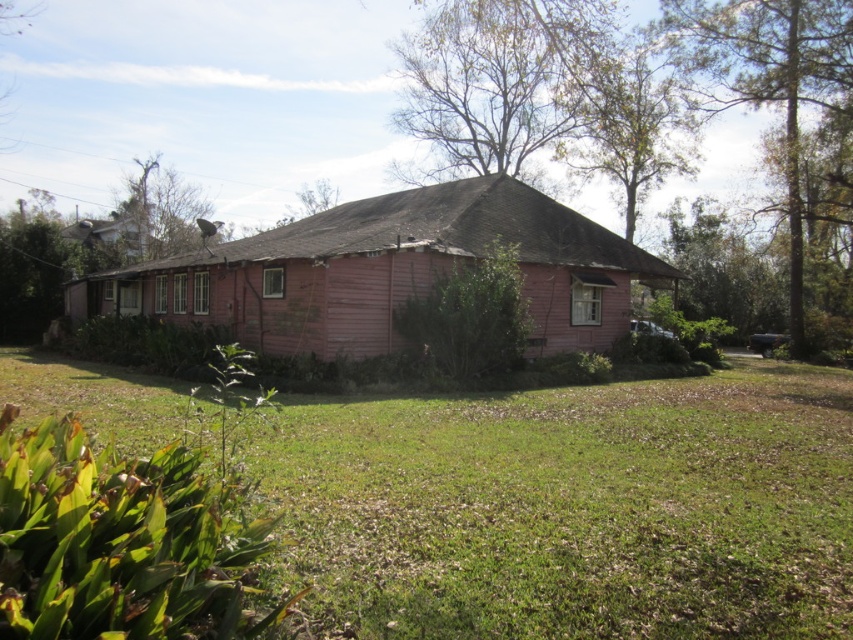
In the scene shown: Can you confirm if pink wood house at center is positioned to the right of green leafy tree at upper right?

Incorrect, pink wood house at center is not on the right side of green leafy tree at upper right.

Measure the distance between pink wood house at center and green leafy tree at upper right.

pink wood house at center is 16.00 meters from green leafy tree at upper right.

The width and height of the screenshot is (853, 640). Identify the location of pink wood house at center. (387, 273).

From the picture: Does green grass at lower center appear under pink wood house at center?

Yes.

Does green grass at lower center come in front of pink wood house at center?

Yes, green grass at lower center is closer to the viewer.

At what (x,y) coordinates should I click in order to perform the action: click on green grass at lower center. Please return your answer as a coordinate pair (x, y). Looking at the image, I should click on (573, 508).

Where is `green grass at lower center`? The width and height of the screenshot is (853, 640). green grass at lower center is located at coordinates (573, 508).

Does green leafy bush at center have a lesser width compared to metallic satellite dish at upper left?

Yes, green leafy bush at center is thinner than metallic satellite dish at upper left.

Does point (467, 348) come closer to viewer compared to point (148, 221)?

Yes, point (467, 348) is in front of point (148, 221).

You are a GUI agent. You are given a task and a screenshot of the screen. Output one action in this format:
    pyautogui.click(x=<x>, y=<y>)
    Task: Click on the green leafy bush at center
    Image resolution: width=853 pixels, height=640 pixels.
    Given the screenshot: What is the action you would take?
    point(471,316)